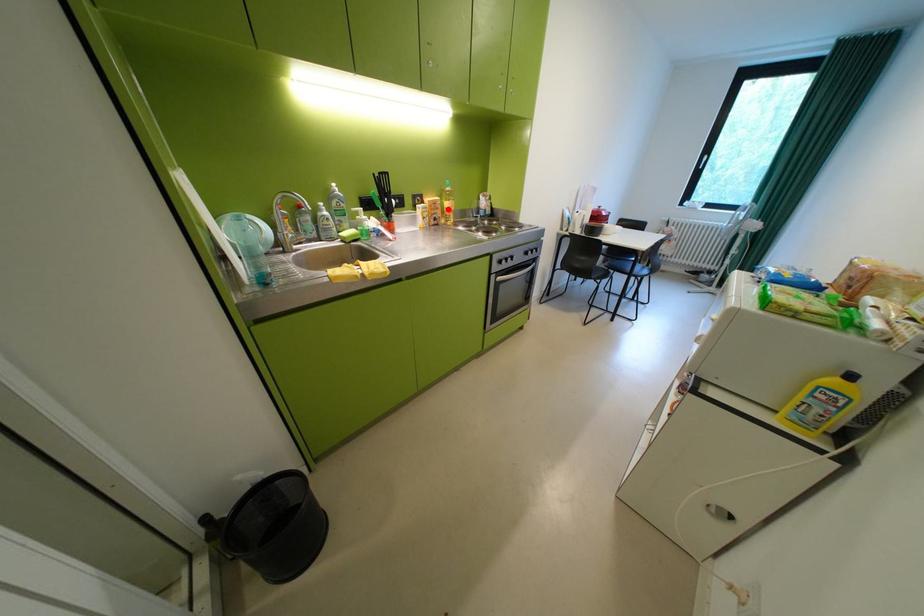
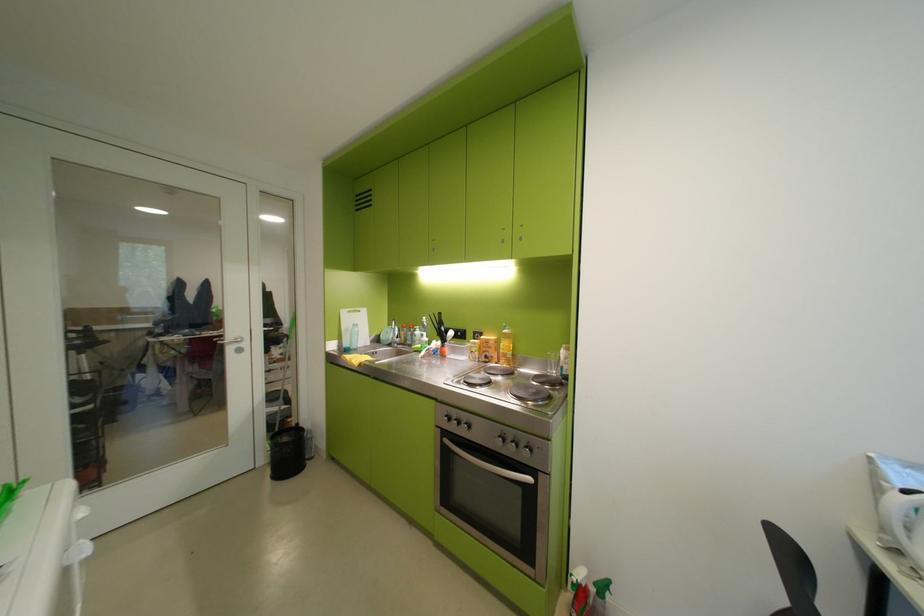
Where in the second image is the point corresponding to the highlighted location from the first image?

(501, 349)